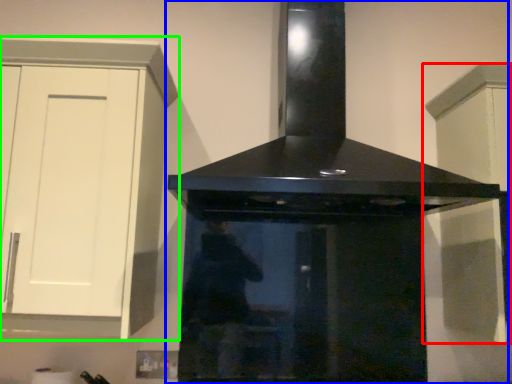
Question: Which is nearer to the cabinetry (highlighted by a red box)? home appliance (highlighted by a blue box) or cabinetry (highlighted by a green box).

Choices:
 (A) home appliance
 (B) cabinetry

Answer: (A)